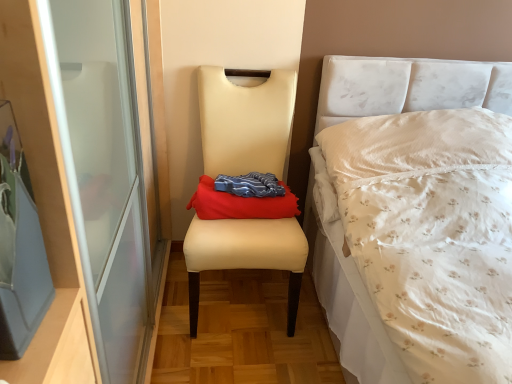
Locate an element on the screen. The height and width of the screenshot is (384, 512). beige leather chair at center is located at coordinates pos(245,122).

What do you see at coordinates (245, 122) in the screenshot?
I see `beige leather chair at center` at bounding box center [245, 122].

What do you see at coordinates (240, 204) in the screenshot? The image size is (512, 384). I see `red fabric throw pillow at center` at bounding box center [240, 204].

Locate an element on the screen. The height and width of the screenshot is (384, 512). red fabric throw pillow at center is located at coordinates (240, 204).

Identify the location of beige leather chair at center. Image resolution: width=512 pixels, height=384 pixels. [x=245, y=122].

Which is more to the right, red fabric throw pillow at center or beige leather chair at center?

From the viewer's perspective, red fabric throw pillow at center appears more on the right side.

From the picture: Which object is more forward, red fabric throw pillow at center or beige leather chair at center?

beige leather chair at center is closer to the camera.

Does point (215, 201) appear closer or farther from the camera than point (291, 301)?

Point (215, 201) appears to be closer to the viewer than point (291, 301).

From the image's perspective, between red fabric throw pillow at center and beige leather chair at center, who is located below?

From the image's view, beige leather chair at center is below.

From a real-world perspective, who is located higher, red fabric throw pillow at center or beige leather chair at center?

red fabric throw pillow at center.

Does red fabric throw pillow at center have a greater width compared to beige leather chair at center?

No.

Is red fabric throw pillow at center taller or shorter than beige leather chair at center?

Clearly, red fabric throw pillow at center is shorter compared to beige leather chair at center.

In the scene shown: Which of these two, red fabric throw pillow at center or beige leather chair at center, is smaller?

Smaller between the two is red fabric throw pillow at center.

Can we say red fabric throw pillow at center lies outside beige leather chair at center?

No, red fabric throw pillow at center is inside or overlapping with beige leather chair at center.

Would you say red fabric throw pillow at center is a long distance from beige leather chair at center?

No, red fabric throw pillow at center is not far from beige leather chair at center.

Is red fabric throw pillow at center oriented away from beige leather chair at center?

Yes, red fabric throw pillow at center is positioned with its back facing beige leather chair at center.

How many degrees apart are the facing directions of red fabric throw pillow at center and beige leather chair at center?

The angular difference between red fabric throw pillow at center and beige leather chair at center is 0.449 degrees.

How distant is red fabric throw pillow at center from beige leather chair at center?

red fabric throw pillow at center is 29.07 centimeters from beige leather chair at center.

The width and height of the screenshot is (512, 384). I want to click on chair below the red fabric throw pillow at center (from a real-world perspective), so click(245, 122).

Between beige leather chair at center and red fabric throw pillow at center, which one appears on the right side from the viewer's perspective?

From the viewer's perspective, red fabric throw pillow at center appears more on the right side.

Is beige leather chair at center positioned behind red fabric throw pillow at center?

No, it is in front of red fabric throw pillow at center.

Is point (243, 113) less distant than point (237, 212)?

No, (243, 113) is further to viewer.

From the image's perspective, is beige leather chair at center located above or below red fabric throw pillow at center?

beige leather chair at center is below red fabric throw pillow at center.

From a real-world perspective, is beige leather chair at center positioned over red fabric throw pillow at center based on gravity?

Actually, beige leather chair at center is physically below red fabric throw pillow at center in the real world.

In terms of width, does beige leather chair at center look wider or thinner when compared to red fabric throw pillow at center?

beige leather chair at center is wider than red fabric throw pillow at center.

Who is taller, beige leather chair at center or red fabric throw pillow at center?

beige leather chair at center is taller.

Between beige leather chair at center and red fabric throw pillow at center, which one has smaller size?

red fabric throw pillow at center is smaller.

Is red fabric throw pillow at center located within beige leather chair at center?

Yes, red fabric throw pillow at center is a part of beige leather chair at center.

Does beige leather chair at center touch red fabric throw pillow at center?

No.

Could you tell me if beige leather chair at center is turned towards red fabric throw pillow at center?

Yes, beige leather chair at center is oriented towards red fabric throw pillow at center.

How much distance is there between beige leather chair at center and red fabric throw pillow at center?

A distance of 11.44 inches exists between beige leather chair at center and red fabric throw pillow at center.

You are a GUI agent. You are given a task and a screenshot of the screen. Output one action in this format:
    pyautogui.click(x=<x>, y=<y>)
    Task: Click on the throw pillow above the beige leather chair at center (from a real-world perspective)
    This screenshot has height=384, width=512.
    Given the screenshot: What is the action you would take?
    pyautogui.click(x=240, y=204)

The image size is (512, 384). I want to click on throw pillow behind the beige leather chair at center, so click(240, 204).

Find the location of a particular element. The height and width of the screenshot is (384, 512). chair that is under the red fabric throw pillow at center (from a real-world perspective) is located at coordinates (245, 122).